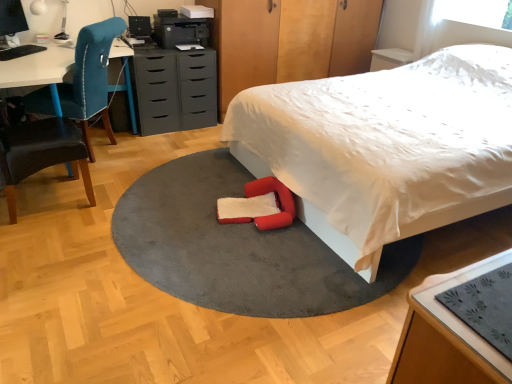
Locate an element on the screen. Image resolution: width=512 pixels, height=384 pixels. vacant area that is in front of matte gray chest of drawers at center is located at coordinates coord(183,138).